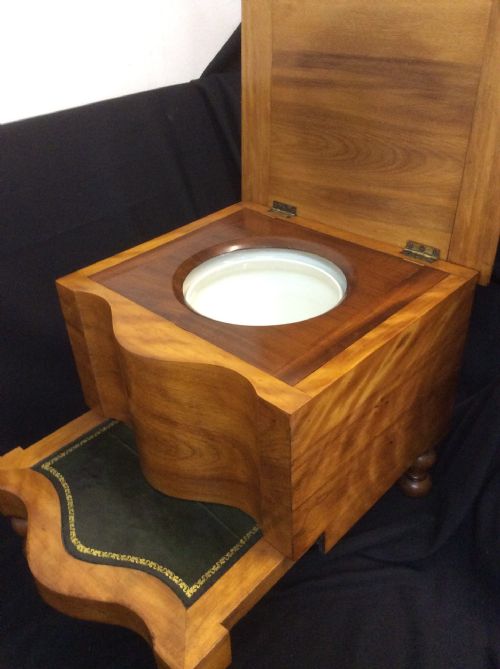
Locate an element on the screen. This screenshot has width=500, height=669. wall is located at coordinates (129, 43).